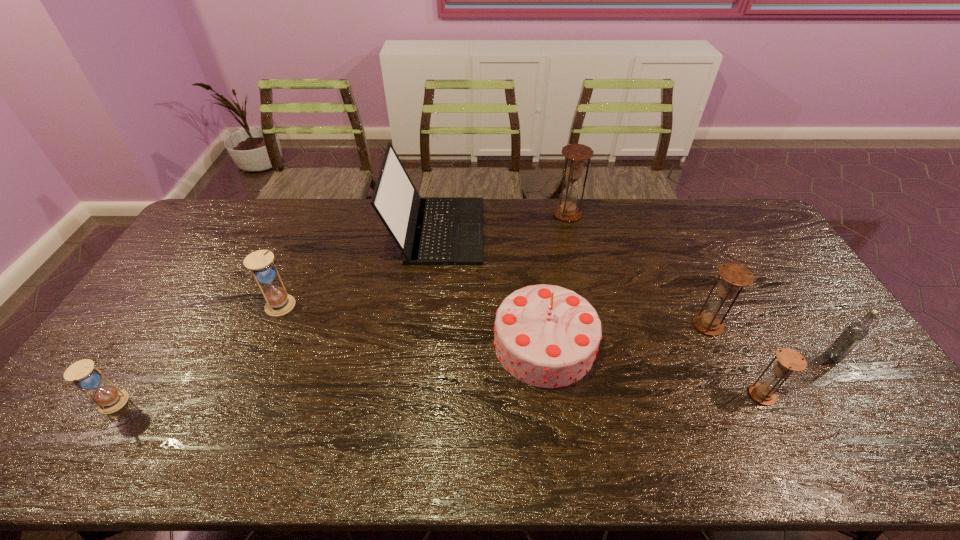
This screenshot has height=540, width=960. I want to click on the biggest brown hourglass, so click(x=576, y=154).

Locate an element on the screen. the farthest hourglass is located at coordinates (576, 154).

Find the location of a particular element. laptop is located at coordinates (428, 230).

Locate an element on the screen. This screenshot has width=960, height=540. gray laptop is located at coordinates (428, 230).

Identify the location of the second farthest brown hourglass. (734, 276).

This screenshot has height=540, width=960. I want to click on the bigger white hourglass, so click(278, 302).

Locate an element on the screen. The height and width of the screenshot is (540, 960). the fourth hourglass from right to left is located at coordinates (278, 302).

Where is `birthday cake`? birthday cake is located at coordinates (547, 336).

Locate an element on the screen. The width and height of the screenshot is (960, 540). the rightmost object is located at coordinates (855, 332).

This screenshot has width=960, height=540. I want to click on the smallest brown hourglass, so click(x=789, y=360).